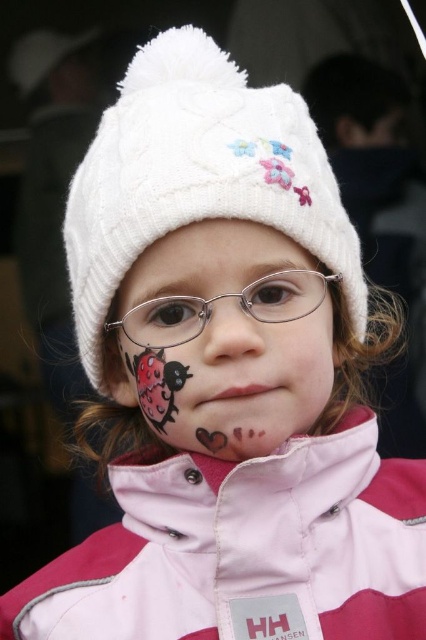
Question: Can you confirm if white knitted hat at center is wider than matte plastic nose at center?

Choices:
 (A) yes
 (B) no

Answer: (A)

Question: Which object is the farthest from the white knitted hat at center?

Choices:
 (A) matte pink face at center
 (B) matte plastic nose at center
 (C) metallic silver glasses at center
 (D) pink softshell jacket at center

Answer: (D)

Question: Which point appears farthest from the camera in this image?

Choices:
 (A) (253, 504)
 (B) (198, 378)
 (C) (218, 100)
 (D) (160, 316)

Answer: (C)

Question: Among these objects, which one is farthest from the camera?

Choices:
 (A) pink softshell jacket at center
 (B) matte plastic nose at center

Answer: (A)

Question: Is white knitted hat at center bigger than metallic silver glasses at center?

Choices:
 (A) yes
 (B) no

Answer: (A)

Question: Is pink softshell jacket at center positioned at the back of metallic silver glasses at center?

Choices:
 (A) no
 (B) yes

Answer: (A)